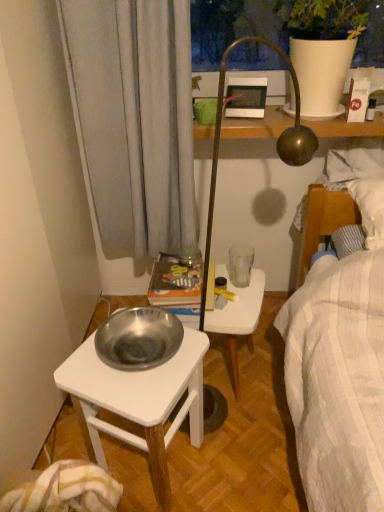
Question: Based on their positions, is silver metallic bowl at lower left located to the left or right of white plastic stool at center?

Choices:
 (A) right
 (B) left

Answer: (B)

Question: From a real-world perspective, is silver metallic bowl at lower left physically located above or below white plastic stool at center?

Choices:
 (A) below
 (B) above

Answer: (B)

Question: Considering the real-world distances, which object is farthest from the transparent glass at right?

Choices:
 (A) orange paper book at center
 (B) silver metallic bowl at lower left
 (C) white plastic stool at center
 (D) matte white picture frame at upper center

Answer: (D)

Question: Which object is positioned farthest from the silver metallic bowl at lower left?

Choices:
 (A) white plastic stool at center
 (B) transparent glass at right
 (C) matte white picture frame at upper center
 (D) orange paper book at center

Answer: (C)